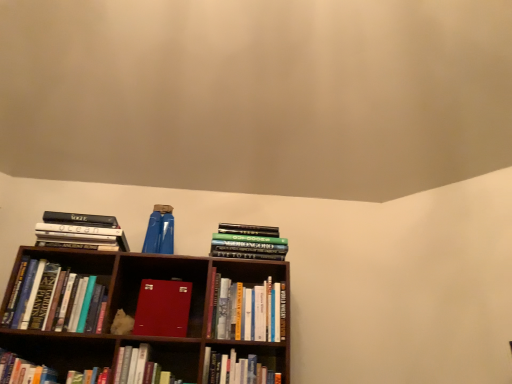
Question: Does hardcover book at lower left, which is the 7th book in right-to-left order, have a greater width compared to hardcover book at lower center, the 3th book from the right?

Choices:
 (A) no
 (B) yes

Answer: (A)

Question: Is hardcover book at lower left, which is the 7th book in right-to-left order, looking in the opposite direction of hardcover book at lower center, the 3th book from the right?

Choices:
 (A) yes
 (B) no

Answer: (B)

Question: Is hardcover book at lower left, which is the 7th book in right-to-left order, closer to the viewer compared to hardcover book at lower center, the 3th book from the right?

Choices:
 (A) yes
 (B) no

Answer: (A)

Question: Is hardcover book at lower left, which ranks as the 2th book in left-to-right order, thinner than hardcover book at lower center, which is the sixth book from left to right?

Choices:
 (A) yes
 (B) no

Answer: (A)

Question: Does hardcover book at lower left, which ranks as the 2th book in left-to-right order, turn towards hardcover book at lower center, the 3th book from the right?

Choices:
 (A) no
 (B) yes

Answer: (A)

Question: Looking at their shapes, would you say hardcover book at lower center, which is the sixth book from left to right, is wider or thinner than hardcover book at lower center, placed as the 5th book when sorted from left to right?

Choices:
 (A) thin
 (B) wide

Answer: (B)

Question: From their relative heights in the image, would you say hardcover book at lower center, the 3th book from the right, is taller or shorter than hardcover book at lower center, arranged as the fourth book when viewed from the right?

Choices:
 (A) short
 (B) tall

Answer: (A)

Question: From a real-world perspective, is hardcover book at lower center, the 3th book from the right, physically located above or below hardcover book at lower center, placed as the 5th book when sorted from left to right?

Choices:
 (A) above
 (B) below

Answer: (B)

Question: Is hardcover book at lower center, the 3th book from the right, spatially inside hardcover book at lower center, arranged as the fourth book when viewed from the right, or outside of it?

Choices:
 (A) inside
 (B) outside

Answer: (B)

Question: From the image's perspective, is hardcover book at lower left, which is the 7th book in right-to-left order, above or below hardcover book at lower center, arranged as the fourth book when viewed from the right?

Choices:
 (A) below
 (B) above

Answer: (B)

Question: From their relative heights in the image, would you say hardcover book at lower left, which ranks as the 2th book in left-to-right order, is taller or shorter than hardcover book at lower center, placed as the 5th book when sorted from left to right?

Choices:
 (A) tall
 (B) short

Answer: (B)

Question: Is point (20, 364) positioned closer to the camera than point (133, 372)?

Choices:
 (A) closer
 (B) farther

Answer: (A)

Question: Based on their positions, is hardcover book at lower left, which is the 7th book in right-to-left order, located to the left or right of hardcover book at lower center, arranged as the fourth book when viewed from the right?

Choices:
 (A) left
 (B) right

Answer: (A)

Question: From a real-world perspective, is hardcover book at lower center, arranged as the fourth book when viewed from the right, physically located above or below hardcover books at left, marked as the third book in a left-to-right arrangement?

Choices:
 (A) above
 (B) below

Answer: (B)

Question: Is hardcover book at lower center, placed as the 5th book when sorted from left to right, situated inside hardcover books at left, marked as the third book in a left-to-right arrangement, or outside?

Choices:
 (A) outside
 (B) inside

Answer: (A)